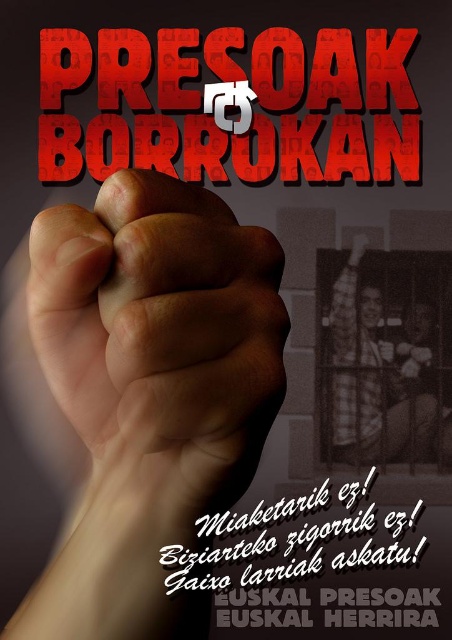
You are an artist analyzing this poster. You notice a point marked at coordinates (x=202, y=106). What object is located at this point?

The point at (x=202, y=106) marks the red textured paper at center.

You are an art curator planning to display this poster in a gallery. The gallery requires that all displayed artworks must have their central subject at least 5 inches away from the viewer to maintain a sense of depth and perspective. Does the smooth skin fist at center meet this requirement?

The smooth skin fist at center is 6.63 inches away from the viewer, which exceeds the 5 inch requirement, so it meets the gallery standard.